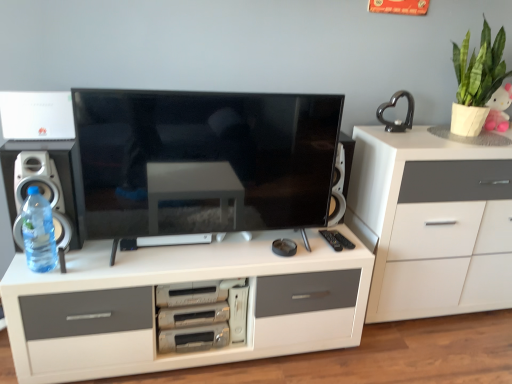
Question: Can you see white plastic speaker at left touching pink plush toy at upper right?

Choices:
 (A) no
 (B) yes

Answer: (A)

Question: From the image's perspective, is white plastic speaker at left under pink plush toy at upper right?

Choices:
 (A) no
 (B) yes

Answer: (B)

Question: Is white plastic speaker at left far from pink plush toy at upper right?

Choices:
 (A) no
 (B) yes

Answer: (B)

Question: Is white plastic speaker at left positioned beyond the bounds of pink plush toy at upper right?

Choices:
 (A) no
 (B) yes

Answer: (B)

Question: Does white plastic speaker at left have a greater height compared to pink plush toy at upper right?

Choices:
 (A) no
 (B) yes

Answer: (B)

Question: Would you say pink plush toy at upper right is to the left or to the right of white matte chest of drawers at center, arranged as the 2th chest of drawers when viewed from the top, in the picture?

Choices:
 (A) right
 (B) left

Answer: (A)

Question: In terms of width, does pink plush toy at upper right look wider or thinner when compared to white matte chest of drawers at center, arranged as the 2th chest of drawers when viewed from the top?

Choices:
 (A) thin
 (B) wide

Answer: (A)

Question: Is pink plush toy at upper right inside or outside of white matte chest of drawers at center, arranged as the 2th chest of drawers when viewed from the top?

Choices:
 (A) inside
 (B) outside

Answer: (B)

Question: Considering their positions, is pink plush toy at upper right located in front of or behind white matte chest of drawers at center, arranged as the 2th chest of drawers when viewed from the top?

Choices:
 (A) front
 (B) behind

Answer: (B)

Question: Considering the positions of black glossy heart at upper right and white matte chest of drawers at center, which is the 1th chest of drawers from bottom to top, in the image, is black glossy heart at upper right taller or shorter than white matte chest of drawers at center, which is the 1th chest of drawers from bottom to top,?

Choices:
 (A) tall
 (B) short

Answer: (A)

Question: From a real-world perspective, is black glossy heart at upper right above or below white matte chest of drawers at center, which is the 1th chest of drawers from bottom to top?

Choices:
 (A) below
 (B) above

Answer: (B)

Question: Considering the positions of point (407, 114) and point (246, 301), is point (407, 114) closer or farther from the camera than point (246, 301)?

Choices:
 (A) closer
 (B) farther

Answer: (B)

Question: From the image's perspective, relative to white matte chest of drawers at center, which is the 1th chest of drawers from bottom to top, is black glossy heart at upper right above or below?

Choices:
 (A) below
 (B) above

Answer: (B)

Question: Is black glossy heart at upper right in front of or behind pink plush toy at upper right in the image?

Choices:
 (A) behind
 (B) front

Answer: (B)

Question: Is black glossy heart at upper right to the left or to the right of pink plush toy at upper right in the image?

Choices:
 (A) right
 (B) left

Answer: (B)